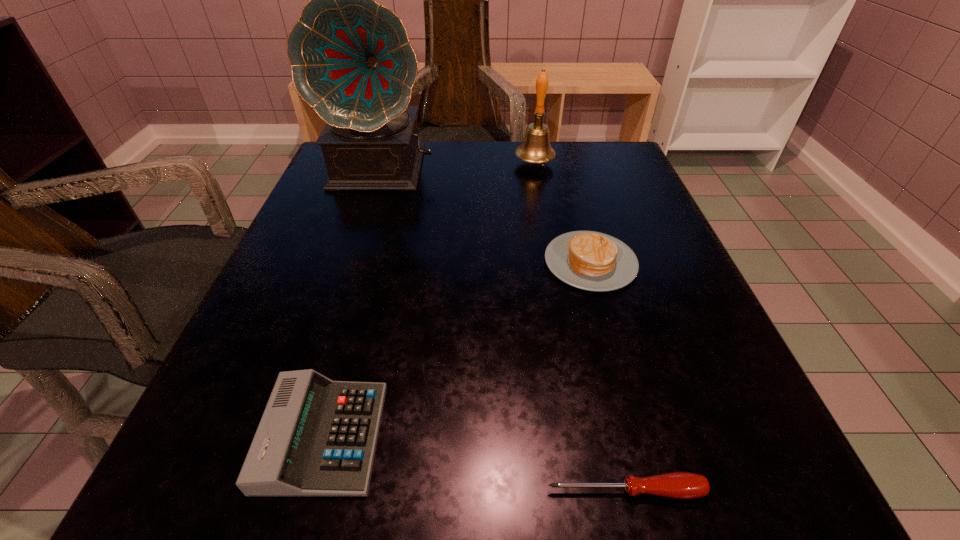
This screenshot has width=960, height=540. I want to click on record player, so click(x=351, y=60).

The image size is (960, 540). I want to click on the second tallest object, so click(535, 148).

Image resolution: width=960 pixels, height=540 pixels. Identify the location of the third nearest object. (588, 260).

Image resolution: width=960 pixels, height=540 pixels. I want to click on calculator, so click(x=317, y=437).

Image resolution: width=960 pixels, height=540 pixels. Identify the location of screwdriver. (683, 485).

Where is `free point located 0.270m on the horn of the record player`? free point located 0.270m on the horn of the record player is located at coordinates (347, 288).

The height and width of the screenshot is (540, 960). Identify the location of vacant space situated on the front of the bell. (558, 289).

Find the location of a particular element. This screenshot has height=540, width=960. vacant space located on the left of the pancake is located at coordinates (493, 262).

The width and height of the screenshot is (960, 540). In order to click on vacant space located 0.240m on the right of the calculator in this screenshot , I will do `click(572, 436)`.

You are a GUI agent. You are given a task and a screenshot of the screen. Output one action in this format:
    pyautogui.click(x=<x>, y=<y>)
    Task: Click on the vacant space located on the right of the shortest object
    The image size is (960, 540).
    Given the screenshot: What is the action you would take?
    pyautogui.click(x=749, y=490)